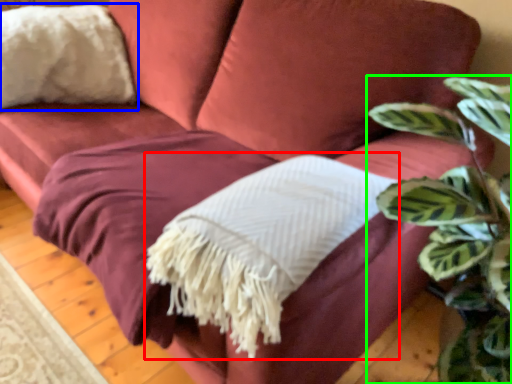
Question: Considering the real-world distances, which object is farthest from blanket (highlighted by a red box)? throw pillow (highlighted by a blue box) or houseplant (highlighted by a green box)?

Choices:
 (A) throw pillow
 (B) houseplant

Answer: (A)